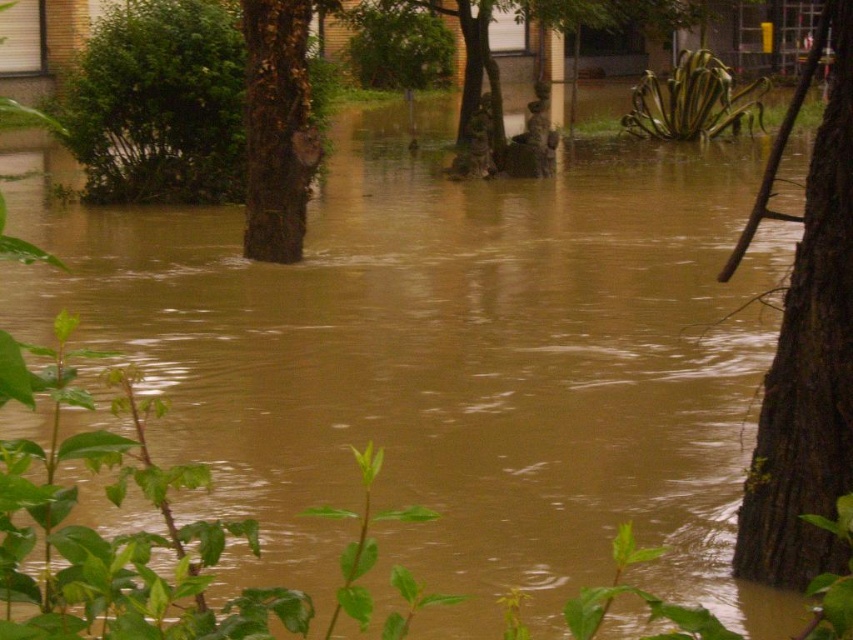
A hiker wants to cross the flooded area and has to move from the green leafy bush at upper left to the brown rough bark tree at center. Given that the hiker can only walk through water up to 5 meters deep, can they safely make this journey?

The distance between the green leafy bush at upper left and the brown rough bark tree at center is 5.26 meters. Since the hiker can only walk through water up to 5 meters deep, the distance exceeds their safe limit, so they cannot safely make this journey.

Looking at this image, you are a drone operator trying to map the flooded area. The drone has a camera with a field of view that covers a 100x100 meter area centered at coordinates 0.5, 0.5. The brown rough bark tree at right is located at 0.541, 0.945. Will the tree be visible in the drone camera image?

The brown rough bark tree at right is located at [805,346]. The drone camera covers a 100x100 meter area centered at [426,320]. Since the tree is at [805,346], which is outside the camera field of view, it will not be visible in the image.

You are a hiker trying to cross the flooded area. You see a brown rough bark tree at right and a green leafy bush at upper left. Which object is closer to the water surface?

The brown rough bark tree at right is positioned under the green leafy bush at upper left, meaning the tree is closer to the water surface than the bush.